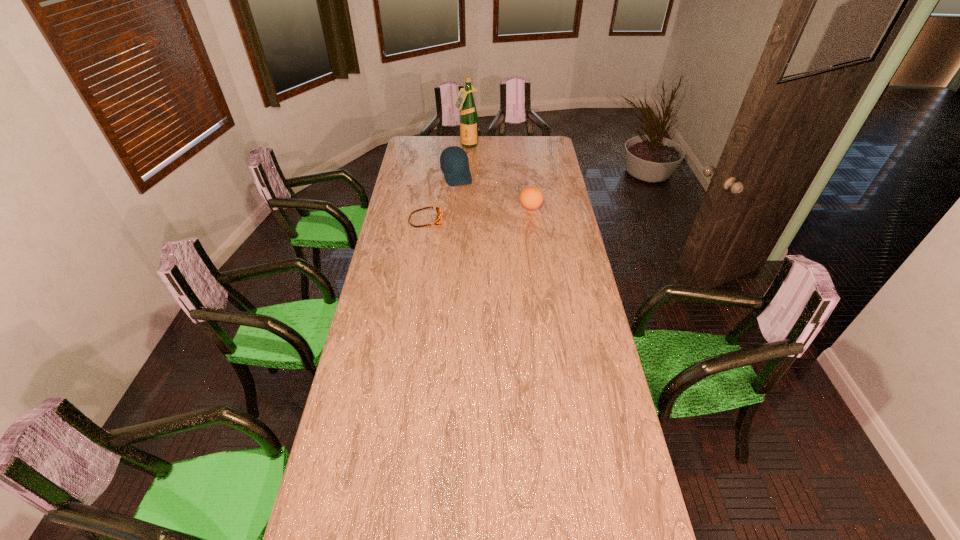
Where is `object that is the second closest to the second tallest object`? Image resolution: width=960 pixels, height=540 pixels. object that is the second closest to the second tallest object is located at coordinates (438, 220).

At what (x,y) coordinates should I click in order to perform the action: click on vacant region that satisfies the following two spatial constraints: 1. on the front side of the orange; 2. on the left side of the third shortest object. Please return your answer as a coordinate pair (x, y). Looking at the image, I should click on coord(454,207).

Where is `vacant position in the image that satisfies the following two spatial constraints: 1. on the front side of the third shortest object; 2. on the left side of the rightmost object`? This screenshot has height=540, width=960. vacant position in the image that satisfies the following two spatial constraints: 1. on the front side of the third shortest object; 2. on the left side of the rightmost object is located at coordinates (454, 207).